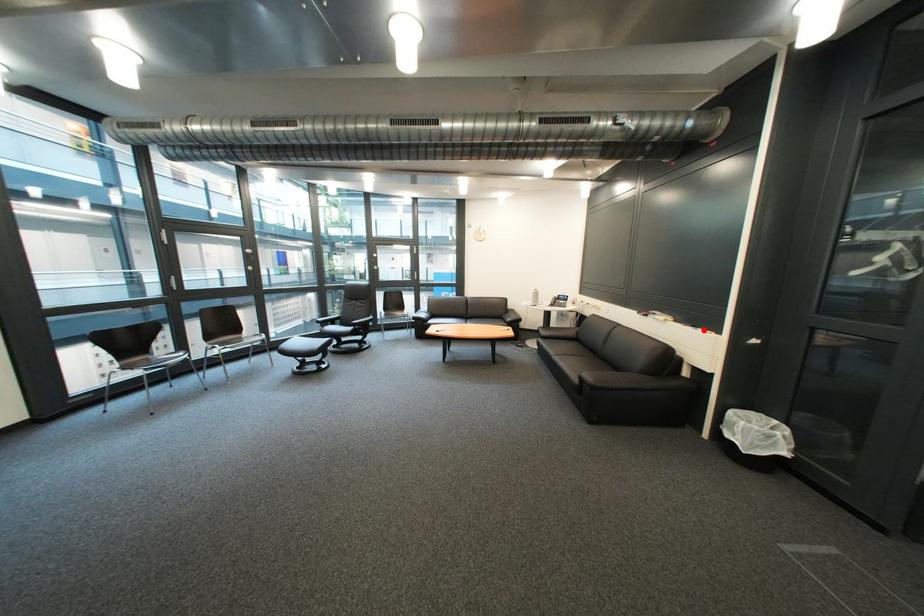
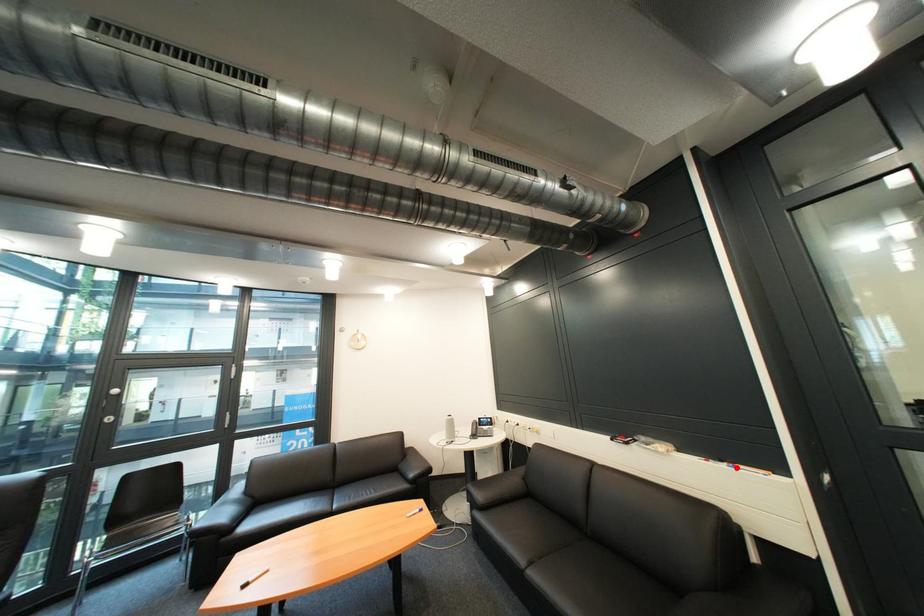
I am providing you with two images of the same scene from different viewpoints. A red point is marked on the first image and another point is marked on the second image. Is the red point in image1 aligned with the point shown in image2?

Yes